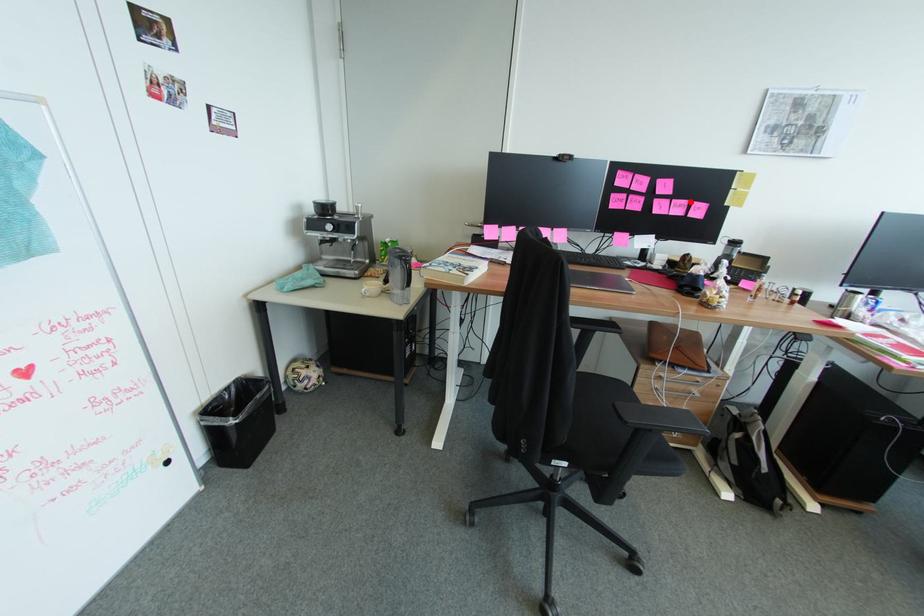
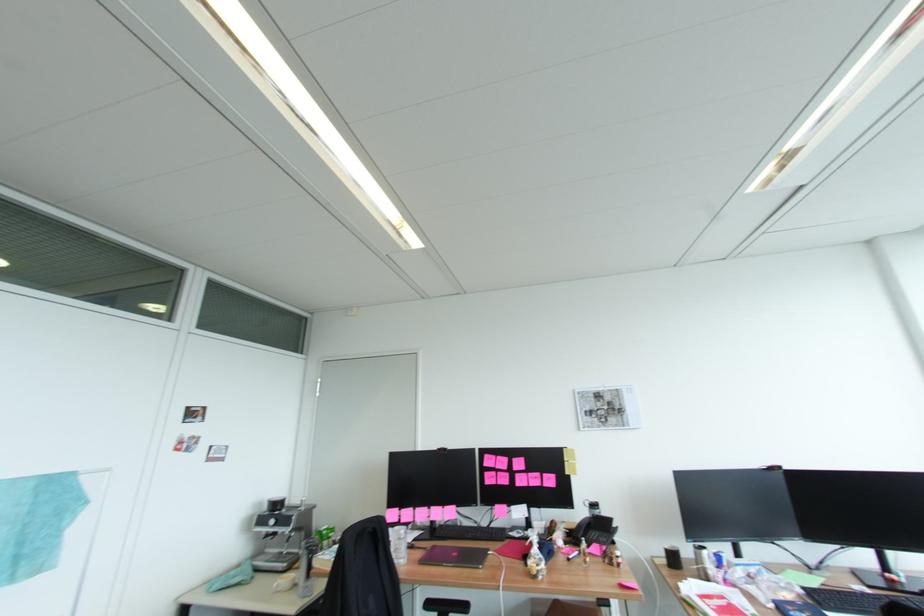
Where in the second image is the point corresponding to the highlighted location from the first image?

(542, 474)